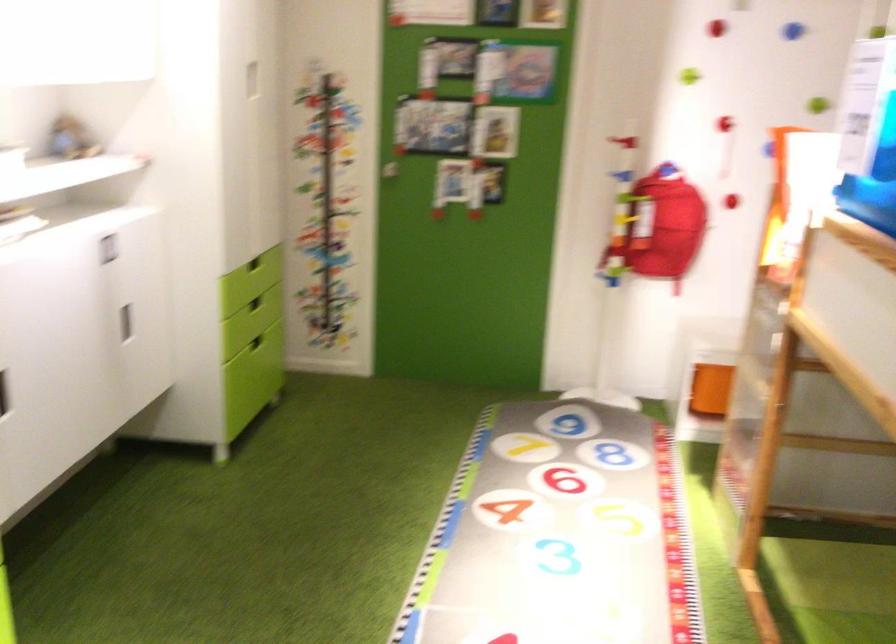
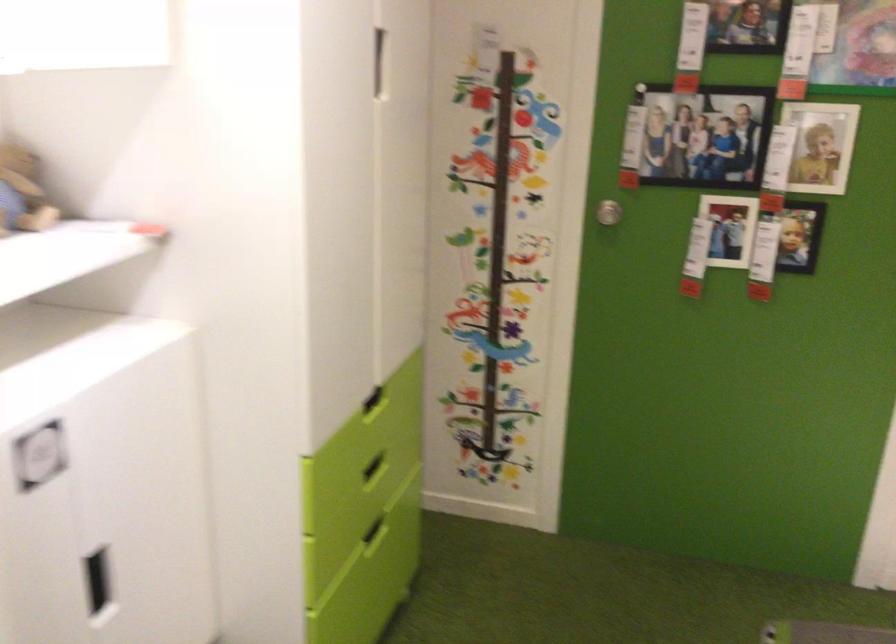
Find the pixel in the second image that matches point 390,169 in the first image.

(607, 212)